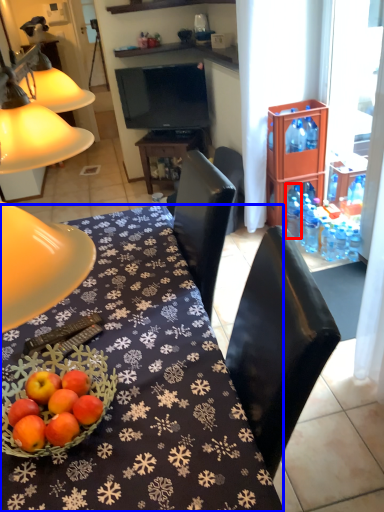
Question: Which of the following is the closest to the observer, bottle (highlighted by a red box) or desk (highlighted by a blue box)?

Choices:
 (A) bottle
 (B) desk

Answer: (B)